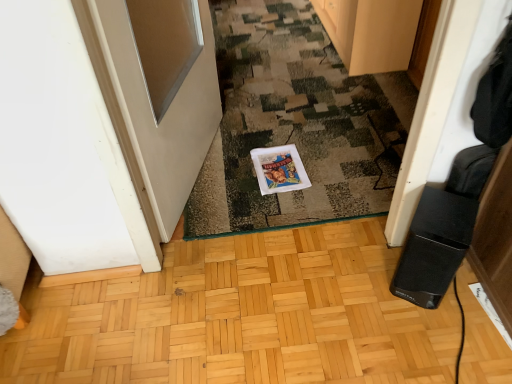
Where is `vacant space that's between wooden cabinet at upper center and white glossy door at left`? This screenshot has width=512, height=384. vacant space that's between wooden cabinet at upper center and white glossy door at left is located at coordinates (289, 94).